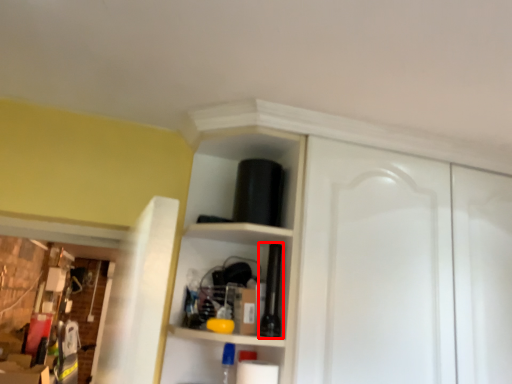
Question: Observing the image, what is the correct spatial positioning of bottle (annotated by the red box) in reference to dresser?

Choices:
 (A) right
 (B) left

Answer: (B)